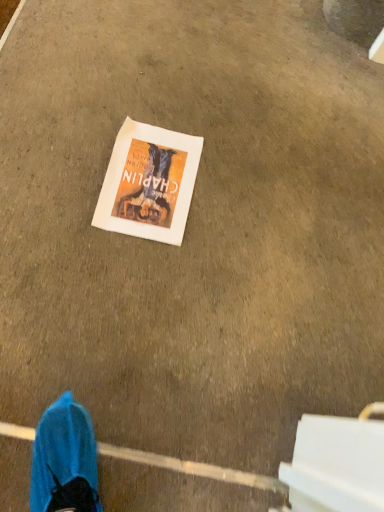
At what (x,y) coordinates should I click in order to perform the action: click on matte paper book cover at center. Please return your answer as a coordinate pair (x, y). Looking at the image, I should click on (149, 183).

What do you see at coordinates (149, 183) in the screenshot? I see `matte paper book cover at center` at bounding box center [149, 183].

The image size is (384, 512). Find the location of `matte paper book cover at center`. matte paper book cover at center is located at coordinates (149, 183).